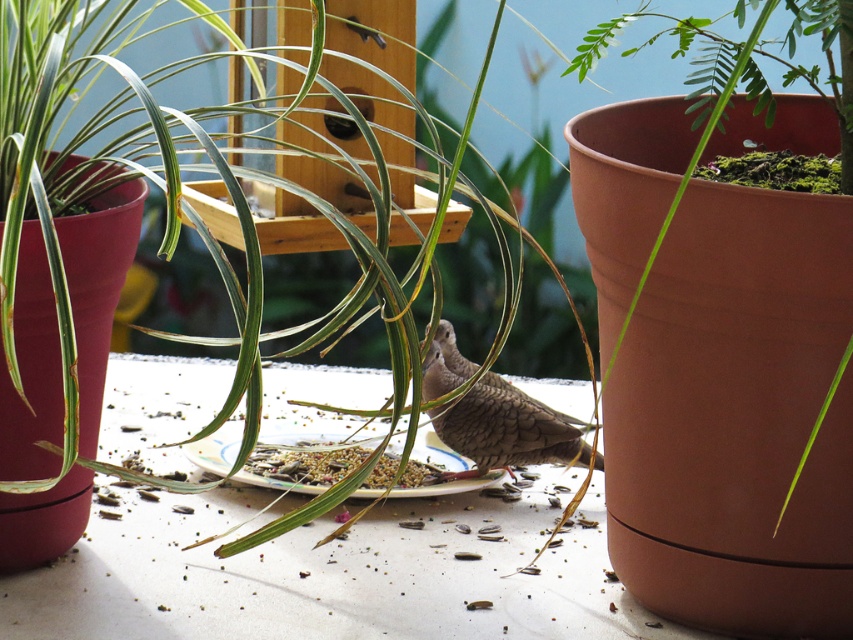
Question: Which point appears farthest from the camera in this image?

Choices:
 (A) (280, 474)
 (B) (448, 292)
 (C) (503, 467)

Answer: (B)

Question: Does green leafy plant at center come behind brown speckled bird at center?

Choices:
 (A) no
 (B) yes

Answer: (A)

Question: From the image, what is the correct spatial relationship of green leafy plant at center in relation to brown speckled bird at center?

Choices:
 (A) right
 (B) left

Answer: (B)

Question: Among these points, which one is nearest to the camera?

Choices:
 (A) (257, 470)
 (B) (0, 458)
 (C) (550, 444)

Answer: (B)

Question: Which is farther from the brown textured seeds at center?

Choices:
 (A) green leafy plant at center
 (B) brown speckled bird at center

Answer: (A)

Question: Does green leafy plant at center have a greater width compared to brown textured seeds at center?

Choices:
 (A) yes
 (B) no

Answer: (A)